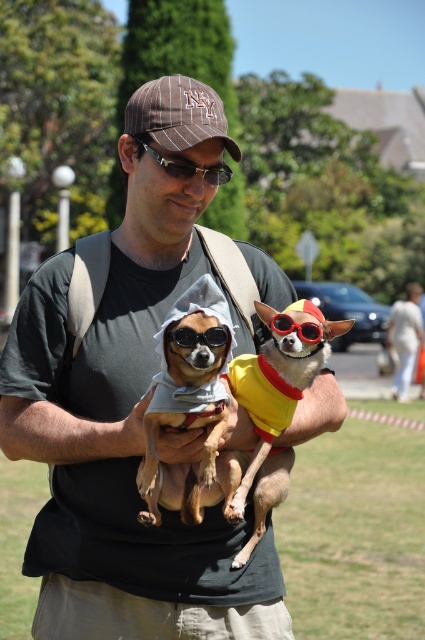
Is yellow fabric dog at center shorter than sunglasses at center?

In fact, yellow fabric dog at center may be taller than sunglasses at center.

What do you see at coordinates (277, 400) in the screenshot? I see `yellow fabric dog at center` at bounding box center [277, 400].

Between point (260, 474) and point (195, 333), which one is positioned behind?

Positioned behind is point (260, 474).

Identify the location of yellow fabric dog at center. (277, 400).

Who is positioned more to the right, matte black t-shirt at center or black plastic sunglasses at center?

black plastic sunglasses at center

Based on the photo, does matte black t-shirt at center have a lesser height compared to black plastic sunglasses at center?

No, matte black t-shirt at center is not shorter than black plastic sunglasses at center.

Does point (110, 422) come farther from viewer compared to point (220, 176)?

No, (110, 422) is closer to viewer.

Identify the location of matte black t-shirt at center. (129, 413).

Does gray fabric dog at center appear on the right side of brown pinstripe baseball cap at center?

Correct, you'll find gray fabric dog at center to the right of brown pinstripe baseball cap at center.

Does point (220, 291) come in front of point (172, 106)?

Yes.

Find the location of a particular element. gray fabric dog at center is located at coordinates click(x=189, y=390).